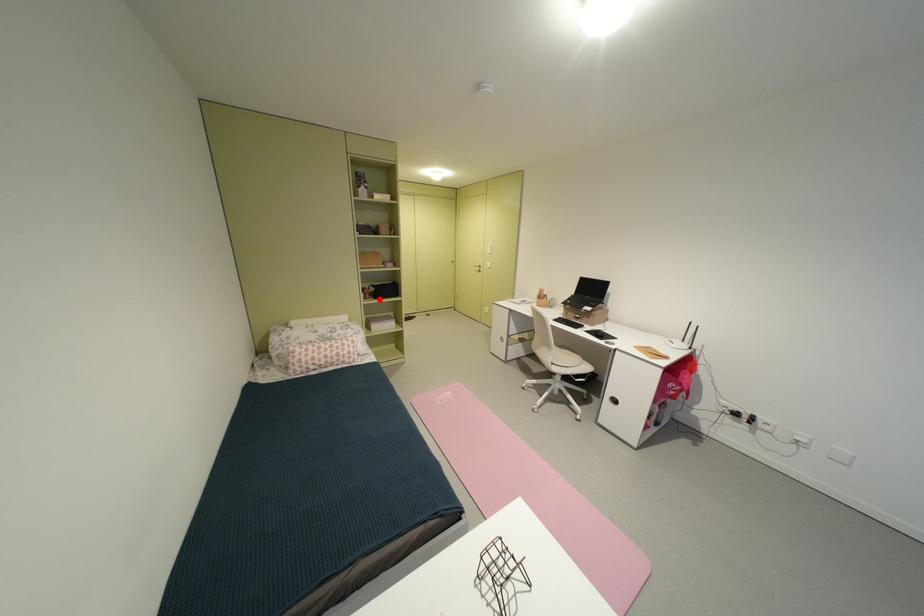
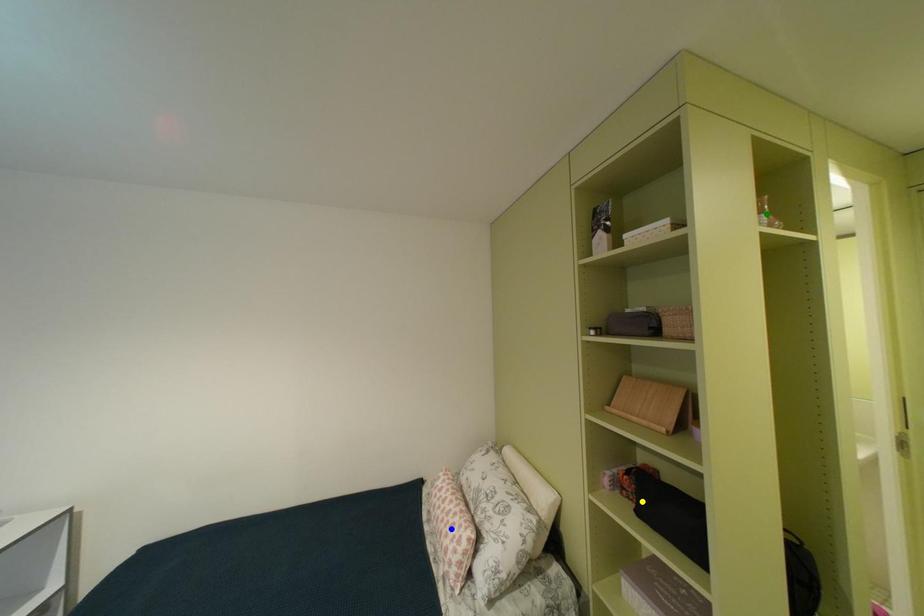
Question: I am providing you with two images of the same scene from different viewpoints. A red point is marked on the first image. You are given multiple points on the second image. Which mark in image 2 goes with the point in image 1?

Choices:
 (A) blue point
 (B) yellow point
 (C) green point

Answer: (B)